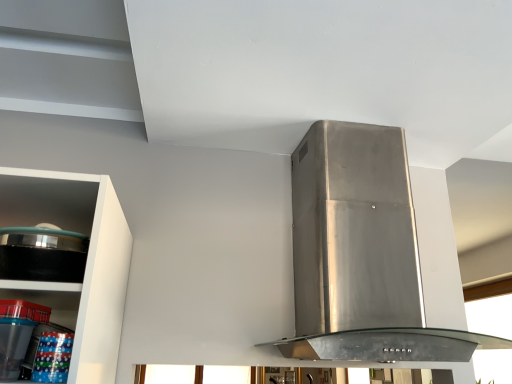
Question: Is clear plastic containers at lower left not inside black glossy pot at left?

Choices:
 (A) yes
 (B) no

Answer: (A)

Question: From a real-world perspective, is clear plastic containers at lower left located higher than black glossy pot at left?

Choices:
 (A) yes
 (B) no

Answer: (B)

Question: Does clear plastic containers at lower left have a greater width compared to black glossy pot at left?

Choices:
 (A) yes
 (B) no

Answer: (A)

Question: Considering the relative sizes of clear plastic containers at lower left and black glossy pot at left in the image provided, is clear plastic containers at lower left thinner than black glossy pot at left?

Choices:
 (A) yes
 (B) no

Answer: (B)

Question: Considering the relative sizes of clear plastic containers at lower left and black glossy pot at left in the image provided, is clear plastic containers at lower left shorter than black glossy pot at left?

Choices:
 (A) no
 (B) yes

Answer: (A)

Question: Is clear plastic containers at lower left smaller than black glossy pot at left?

Choices:
 (A) yes
 (B) no

Answer: (B)

Question: Is clear plastic containers at lower left at the left side of transparent glass window at upper right?

Choices:
 (A) yes
 (B) no

Answer: (A)

Question: Is clear plastic containers at lower left beside transparent glass window at upper right?

Choices:
 (A) no
 (B) yes

Answer: (A)

Question: Is clear plastic containers at lower left smaller than transparent glass window at upper right?

Choices:
 (A) yes
 (B) no

Answer: (A)

Question: Is clear plastic containers at lower left oriented towards transparent glass window at upper right?

Choices:
 (A) yes
 (B) no

Answer: (B)

Question: From a real-world perspective, is clear plastic containers at lower left positioned over transparent glass window at upper right based on gravity?

Choices:
 (A) yes
 (B) no

Answer: (B)

Question: From the image's perspective, is clear plastic containers at lower left on transparent glass window at upper right?

Choices:
 (A) no
 (B) yes

Answer: (B)

Question: Considering the relative sizes of transparent glass window at upper right and clear plastic containers at lower left in the image provided, is transparent glass window at upper right shorter than clear plastic containers at lower left?

Choices:
 (A) yes
 (B) no

Answer: (B)